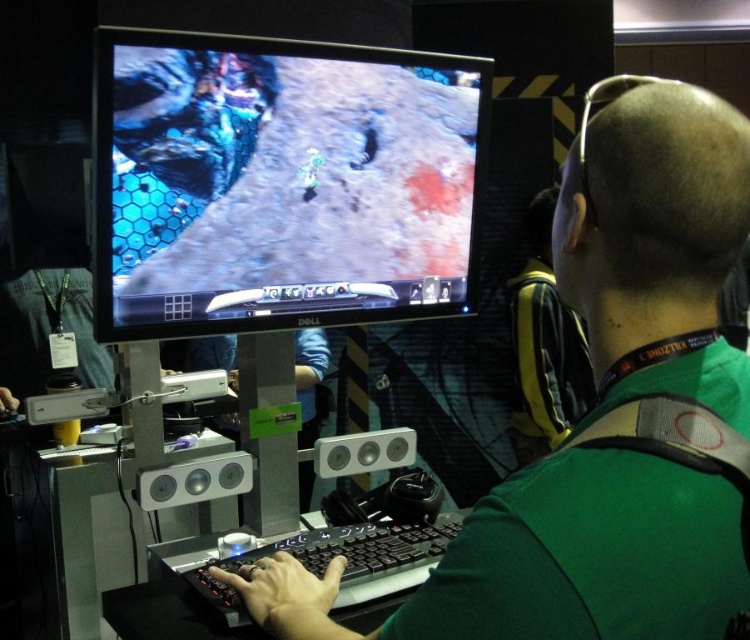
From the picture: Is black glossy monitor at upper center to the right of yellow fabric backpack at upper right from the viewer's perspective?

Incorrect, black glossy monitor at upper center is not on the right side of yellow fabric backpack at upper right.

Is black glossy monitor at upper center taller than yellow fabric backpack at upper right?

Incorrect, black glossy monitor at upper center's height is not larger of yellow fabric backpack at upper right's.

Is point (330, 61) positioned behind point (537, 268)?

No, it is in front of (537, 268).

Where is `black glossy monitor at upper center`? black glossy monitor at upper center is located at coordinates (280, 182).

Can you confirm if green matte shirt at center is bigger than black glossy monitor at upper center?

Yes, green matte shirt at center is bigger than black glossy monitor at upper center.

Is point (645, 340) positioned behind point (294, 253)?

No, it is in front of (294, 253).

This screenshot has height=640, width=750. What are the coordinates of `green matte shirt at center` in the screenshot? It's located at (603, 412).

Is point (464, 584) more distant than point (537, 196)?

That is False.

What do you see at coordinates (603, 412) in the screenshot?
I see `green matte shirt at center` at bounding box center [603, 412].

You are a GUI agent. You are given a task and a screenshot of the screen. Output one action in this format:
    pyautogui.click(x=<x>, y=<y>)
    Task: Click on the green matte shirt at center
    The width and height of the screenshot is (750, 640).
    Given the screenshot: What is the action you would take?
    pyautogui.click(x=603, y=412)